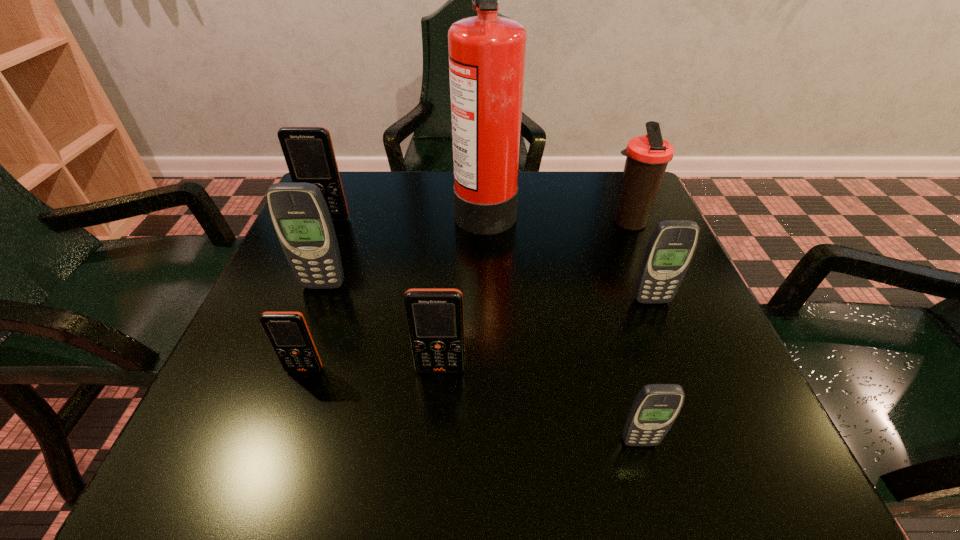
Identify the location of vacant area that lies between the smallest gray cellular telephone and the brown thermos bottle. (634, 333).

In order to click on vacant area that lies between the thermos bottle and the red fire extinguisher in this screenshot , I will do `click(557, 215)`.

The width and height of the screenshot is (960, 540). I want to click on vacant space that is in between the rightmost cellular telephone and the smallest orange cellular telephone, so [x=478, y=335].

Locate an element on the screen. The width and height of the screenshot is (960, 540). free spot between the farthest cellular telephone and the smallest orange cellular telephone is located at coordinates (317, 295).

The image size is (960, 540). In order to click on vacant area that lies between the tallest object and the biggest orange cellular telephone in this screenshot , I will do `click(407, 213)`.

Locate an element on the screen. This screenshot has width=960, height=540. free point between the fire extinguisher and the fifth nearest cellular telephone is located at coordinates (404, 246).

Locate an element on the screen. The height and width of the screenshot is (540, 960). free spot between the tallest object and the biggest orange cellular telephone is located at coordinates (407, 213).

This screenshot has width=960, height=540. In order to click on object that stands as the fourth closest to the rightmost cellular telephone in this screenshot , I will do `click(435, 320)`.

You are a GUI agent. You are given a task and a screenshot of the screen. Output one action in this format:
    pyautogui.click(x=<x>, y=<y>)
    Task: Click on the closest object to the farthest orange cellular telephone
    This screenshot has width=960, height=540.
    Given the screenshot: What is the action you would take?
    click(x=300, y=216)

Select which cellular telephone is the third closest to the second smallest orange cellular telephone. Please provide its 2D coordinates. Your answer should be formatted as a tuple, i.e. [(x, y)], where the tuple contains the x and y coordinates of a point satisfying the conditions above.

[(655, 408)]